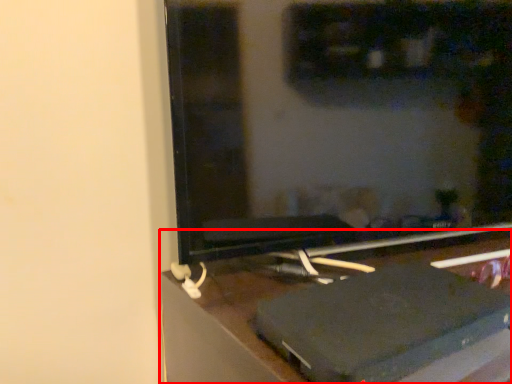
Question: From the image's perspective, where is furniture (annotated by the red box) located relative to computer monitor?

Choices:
 (A) below
 (B) above

Answer: (A)